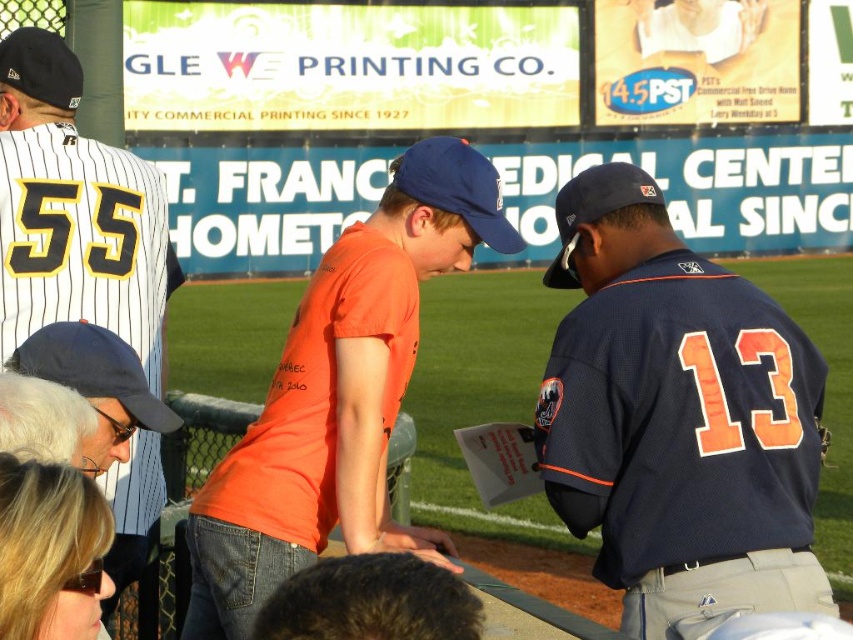
Question: Which of the following is the farthest from the observer?

Choices:
 (A) matte black baseball cap at upper left
 (B) navy blue jersey at center
 (C) blue fabric baseball cap at lower left
 (D) blue fabric baseball cap at center

Answer: (A)

Question: Which point is closer to the camera taking this photo?

Choices:
 (A) (576, 202)
 (B) (33, 372)
 (C) (39, 45)
 (D) (787, 340)

Answer: (B)

Question: Does blue fabric baseball cap at center have a greater width compared to navy blue baseball cap at center?

Choices:
 (A) no
 (B) yes

Answer: (A)

Question: Estimate the real-world distances between objects in this image. Which object is farther from the blue fabric baseball cap at center?

Choices:
 (A) matte black baseball cap at upper left
 (B) blue fabric baseball cap at lower left
 (C) navy blue jersey at center

Answer: (B)

Question: Does blue fabric baseball cap at lower left have a greater width compared to navy blue baseball cap at center?

Choices:
 (A) yes
 (B) no

Answer: (B)

Question: Does white pinstriped jersey at left appear under matte black baseball cap at upper left?

Choices:
 (A) no
 (B) yes

Answer: (B)